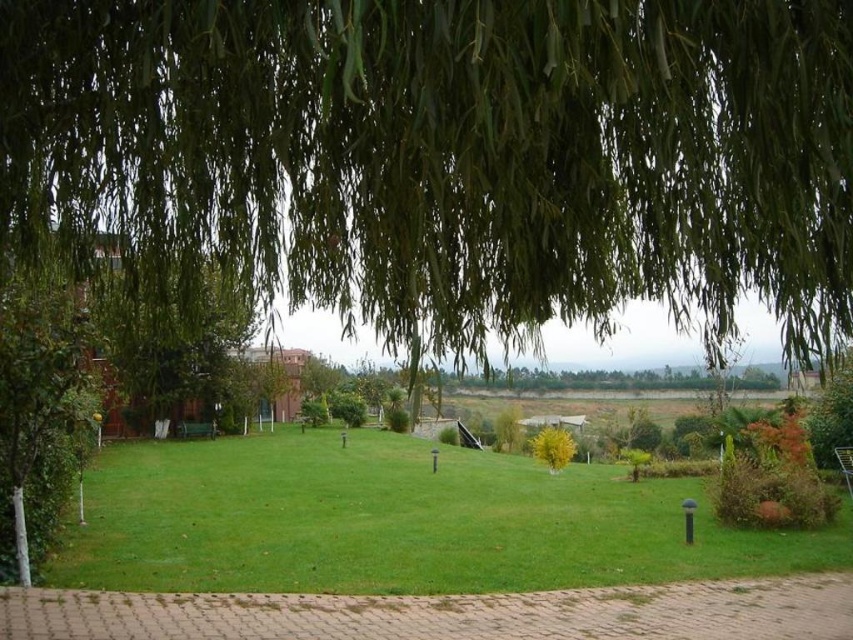
You are standing at the bottom edge of the image where the brick pathway is located. Looking up towards the green leafy willow at upper center, can you estimate its position relative to the center of the image?

The green leafy willow at upper center is located at coordinates approximately 0.241 along the horizontal axis and 0.529 along the vertical axis, which places it slightly to the left of the image center and closer to the top edge.